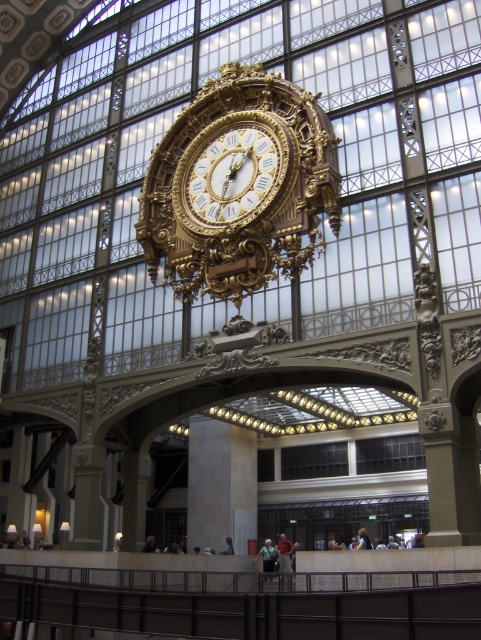
You are an architect designing a new exhibit and need to ensure that the gold ornate clock at center and the smooth concrete pillar at center can be seen clearly from the entrance. Given their heights, which object might block the view of the other when viewed from the entrance?

The gold ornate clock at center is taller than the smooth concrete pillar at center, so it might block the view of the smooth concrete pillar at center if positioned in front of it.